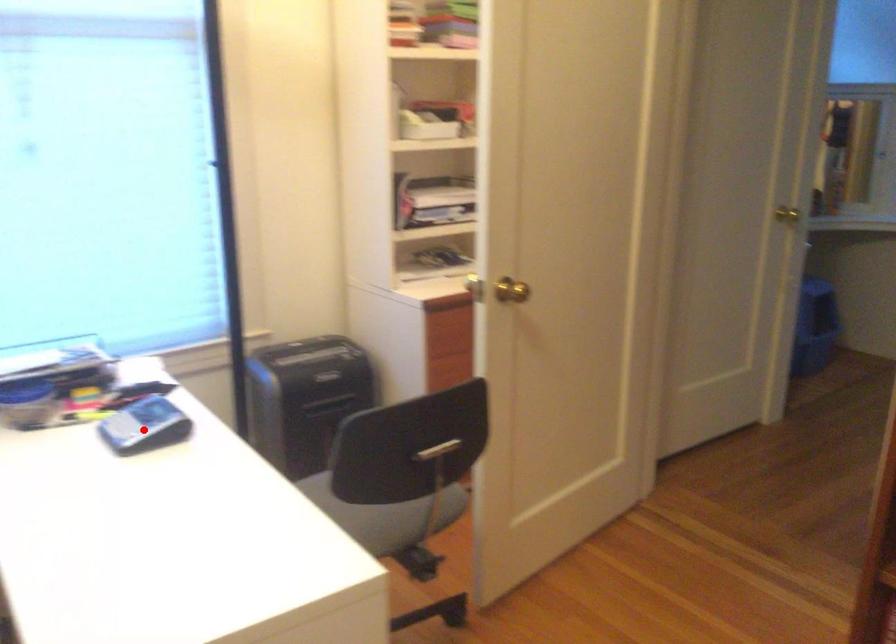
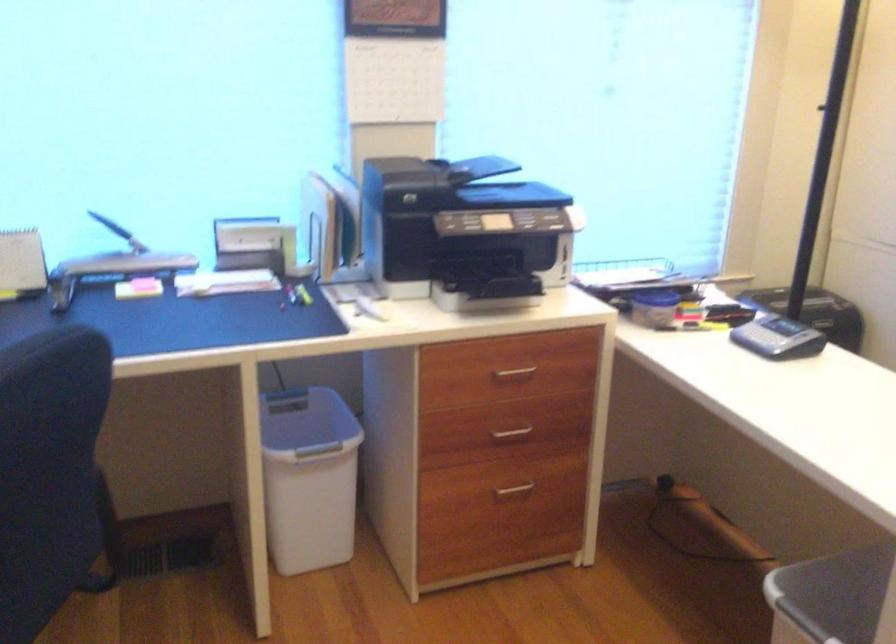
The point at the highlighted location is marked in the first image. Where is the corresponding point in the second image?

(778, 337)